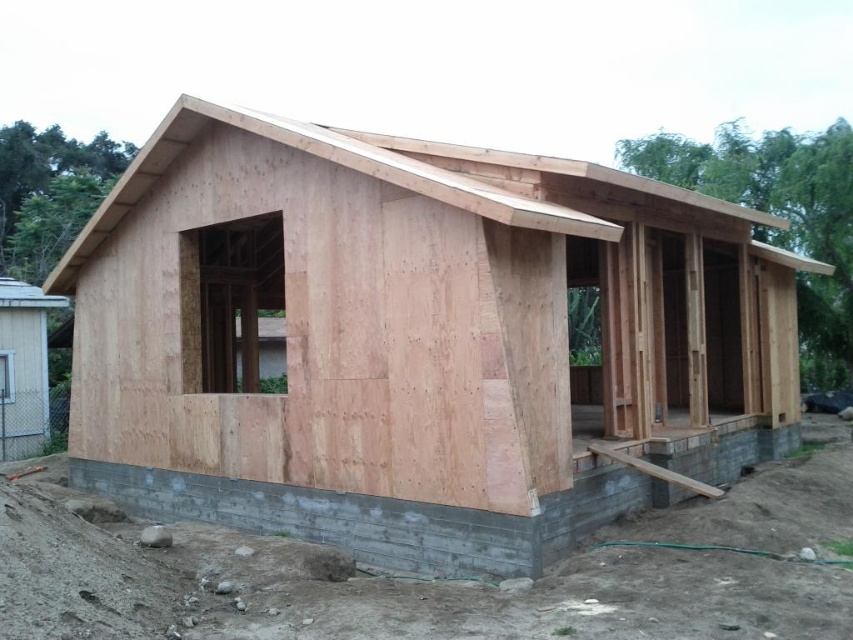
Question: Which point is closer to the camera?

Choices:
 (A) (355, 528)
 (B) (247, 340)
 (C) (73, 260)

Answer: (A)

Question: Can you confirm if natural wood house at center is positioned to the left of gray concrete foundation at lower center?

Choices:
 (A) yes
 (B) no

Answer: (B)

Question: Is the position of gray concrete foundation at lower center less distant than that of natural wood roof at upper center?

Choices:
 (A) no
 (B) yes

Answer: (A)

Question: Is gray concrete foundation at lower center thinner than natural wood roof at upper center?

Choices:
 (A) yes
 (B) no

Answer: (A)

Question: Which object is farther from the camera taking this photo?

Choices:
 (A) gray concrete foundation at lower center
 (B) natural wood house at center
 (C) natural wood roof at upper center

Answer: (A)

Question: Which is nearer to the natural wood house at center?

Choices:
 (A) natural wood roof at upper center
 (B) gray concrete foundation at lower center

Answer: (A)